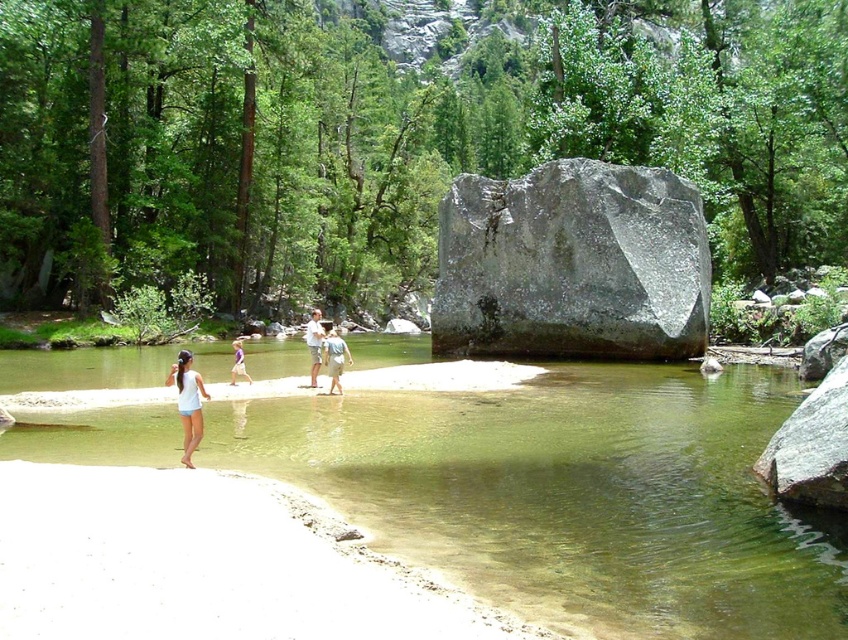
Does clear water at center appear on the left side of light blue denim shorts at center?

Indeed, clear water at center is positioned on the left side of light blue denim shorts at center.

Is point (550, 400) positioned in front of point (328, 374)?

Yes.

The height and width of the screenshot is (640, 848). What are the coordinates of `clear water at center` in the screenshot? It's located at (572, 493).

Does point (326, 340) lie in front of point (311, 368)?

Yes, it is.

Does light blue denim shorts at center have a greater width compared to light brown fabric shirt at center?

No.

Is point (328, 394) closer to viewer compared to point (322, 332)?

Yes, it is.

Find the location of a particular element. This screenshot has width=848, height=640. light blue denim shorts at center is located at coordinates (335, 358).

Is the position of white cotton tank top at lower left less distant than that of light blue denim shorts at center?

Yes, it is.

Does white cotton tank top at lower left appear on the left side of light blue denim shorts at center?

Yes, white cotton tank top at lower left is to the left of light blue denim shorts at center.

Identify the location of white cotton tank top at lower left. The width and height of the screenshot is (848, 640). (188, 403).